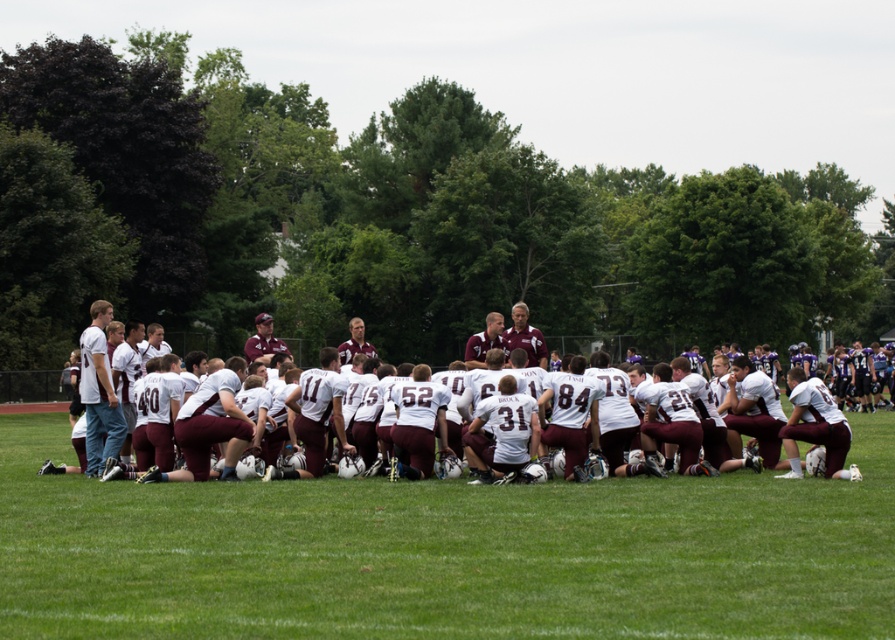
You are a photographer standing on the sidelines of the football field. You want to take a photo of the white matte jersey at center without the white fabric field at center appearing in the background. Is this possible based on their positions?

The white fabric field at center is below the white matte jersey at center, so if you position yourself above the jersey, you can capture it without the field in the background.